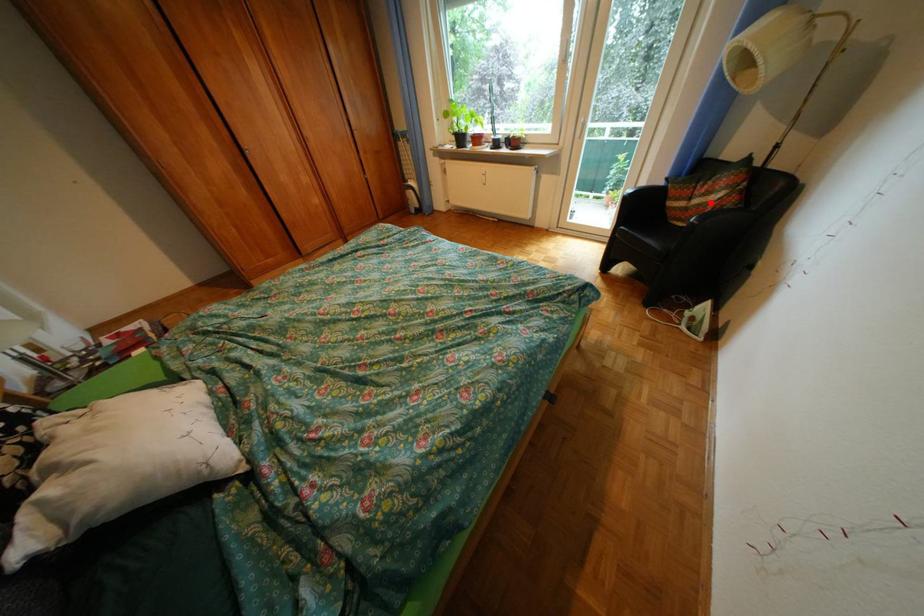
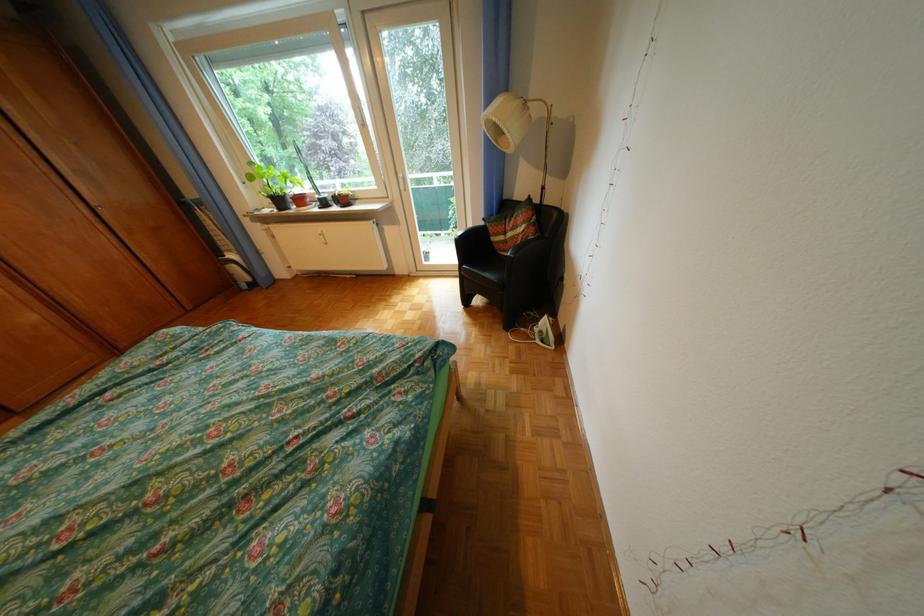
Where in the second image is the point corresponding to the highlighted location from the first image?

(524, 236)